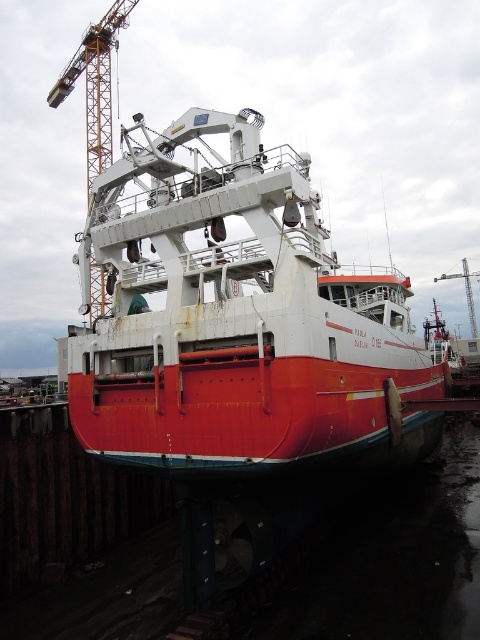
You are standing on the deck of the fishing vessel Paula and need to operate the metallic yellow crane at upper left and the brushed metal crane at upper center. Which crane would you reach first if you walk directly towards them from your current position?

You would reach the metallic yellow crane at upper left first because it is closer to you than the brushed metal crane at upper center.

You are a marine inspector tasked with checking the coordinates of all boats in the harbor. According to the image, where exactly is the rusty metal boat at center located?

The rusty metal boat at center is located at point (237, 321).